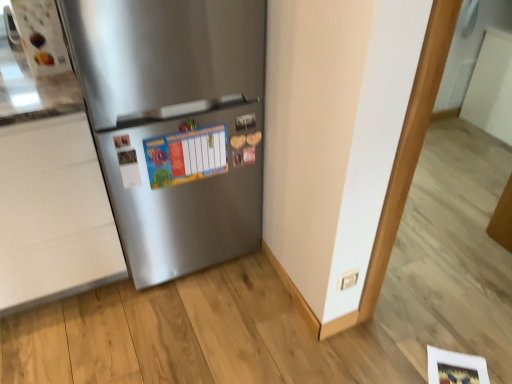
In order to face satin silver refrigerator at center, should I rotate leftwards or rightwards?

To align with it, rotate left about 12.243°.

Locate an element on the screen. satin silver refrigerator at center is located at coordinates (175, 125).

The image size is (512, 384). What do you see at coordinates (175, 125) in the screenshot? I see `satin silver refrigerator at center` at bounding box center [175, 125].

The height and width of the screenshot is (384, 512). I want to click on satin silver refrigerator at center, so click(x=175, y=125).